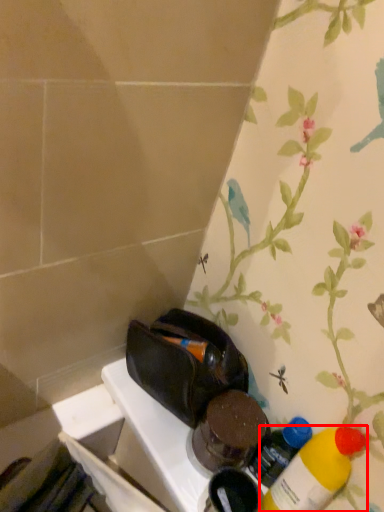
Question: From the image's perspective, considering the relative positions of bottle (annotated by the red box) and bottle in the image provided, where is bottle (annotated by the red box) located with respect to the staircase?

Choices:
 (A) below
 (B) above

Answer: (A)